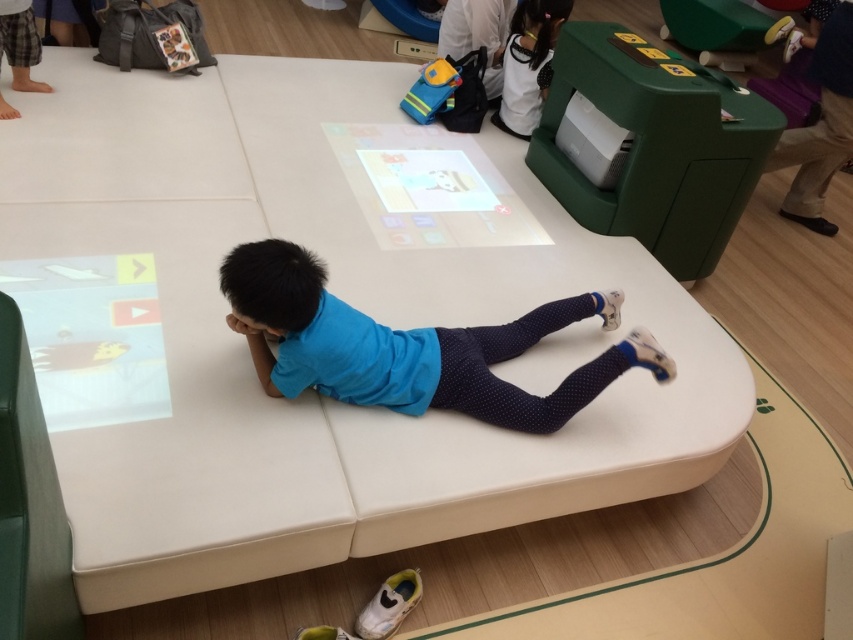
Question: Can you confirm if blue fabric shirt at center is smaller than white matte shirt at upper right?

Choices:
 (A) no
 (B) yes

Answer: (A)

Question: Among these points, which one is farthest from the camera?

Choices:
 (A) (450, 349)
 (B) (531, 81)

Answer: (B)

Question: Which point appears closest to the camera in this image?

Choices:
 (A) click(308, 305)
 (B) click(541, 68)

Answer: (A)

Question: Is blue fabric shirt at center above white matte shirt at upper right?

Choices:
 (A) yes
 (B) no

Answer: (B)

Question: Which point appears closest to the camera in this image?

Choices:
 (A) (444, 392)
 (B) (525, 1)

Answer: (A)

Question: Is blue fabric shirt at center positioned in front of white matte shirt at upper right?

Choices:
 (A) yes
 (B) no

Answer: (A)